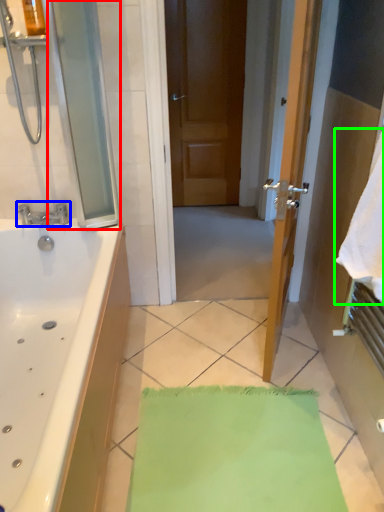
Question: Considering the real-world distances, which object is closest to screen door (highlighted by a red box)? tap (highlighted by a blue box) or beach towel (highlighted by a green box).

Choices:
 (A) tap
 (B) beach towel

Answer: (A)